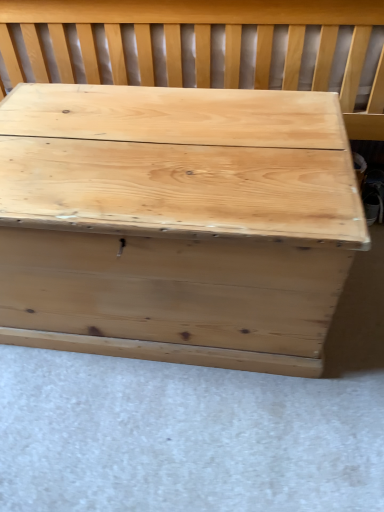
Question: From a real-world perspective, is natural wood chest at center beneath natural wood trunk at center?

Choices:
 (A) yes
 (B) no

Answer: (B)

Question: Does natural wood chest at center have a lesser height compared to natural wood trunk at center?

Choices:
 (A) yes
 (B) no

Answer: (B)

Question: Considering the relative positions of natural wood chest at center and natural wood trunk at center in the image provided, is natural wood chest at center behind natural wood trunk at center?

Choices:
 (A) no
 (B) yes

Answer: (B)

Question: Is natural wood chest at center at the right side of natural wood trunk at center?

Choices:
 (A) yes
 (B) no

Answer: (A)

Question: From a real-world perspective, is natural wood chest at center positioned over natural wood trunk at center based on gravity?

Choices:
 (A) yes
 (B) no

Answer: (A)

Question: Considering the relative sizes of natural wood chest at center and natural wood trunk at center in the image provided, is natural wood chest at center wider than natural wood trunk at center?

Choices:
 (A) no
 (B) yes

Answer: (B)

Question: Is natural wood trunk at center not inside natural wood chest at center?

Choices:
 (A) yes
 (B) no

Answer: (A)

Question: Can you confirm if natural wood trunk at center is wider than natural wood chest at center?

Choices:
 (A) no
 (B) yes

Answer: (A)

Question: Is natural wood trunk at center facing towards natural wood chest at center?

Choices:
 (A) no
 (B) yes

Answer: (A)

Question: From a real-world perspective, does natural wood trunk at center sit lower than natural wood chest at center?

Choices:
 (A) no
 (B) yes

Answer: (B)

Question: Is natural wood trunk at center oriented away from natural wood chest at center?

Choices:
 (A) yes
 (B) no

Answer: (A)

Question: Is natural wood trunk at center positioned before natural wood chest at center?

Choices:
 (A) no
 (B) yes

Answer: (B)

Question: Based on their sizes in the image, would you say natural wood chest at center is bigger or smaller than natural wood trunk at center?

Choices:
 (A) small
 (B) big

Answer: (B)